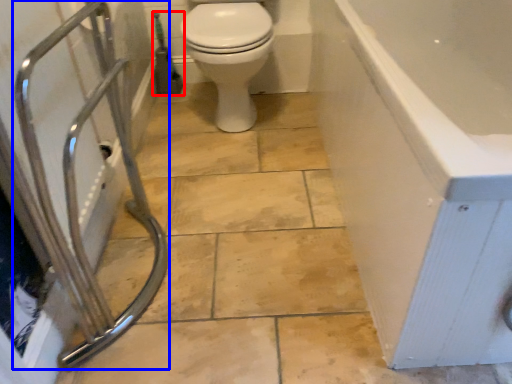
Question: Which of the following is the farthest to the observer, garden hose (highlighted by a red box) or shower (highlighted by a blue box)?

Choices:
 (A) garden hose
 (B) shower

Answer: (A)